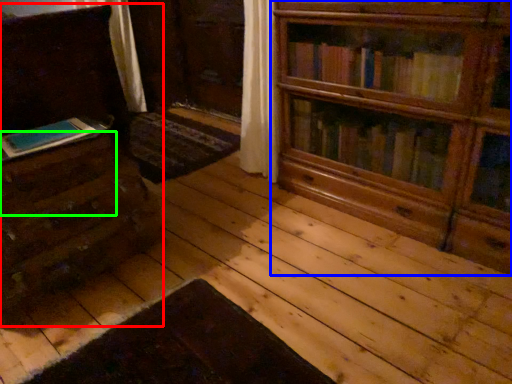
Question: Based on their relative distances, which object is nearer to chest of drawers (highlighted by a red box)? Choose from bookcase (highlighted by a blue box) and drawer (highlighted by a green box).

Choices:
 (A) bookcase
 (B) drawer

Answer: (B)